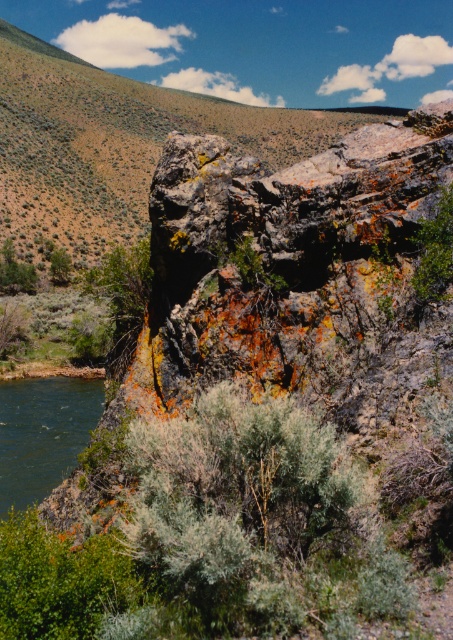
Question: Estimate the real-world distances between objects in this image. Which object is farther from the green leafy shrub at center?

Choices:
 (A) dark green water at lower left
 (B) green leafy shrub at left

Answer: (B)

Question: Which of these objects is positioned closest to the green leafy shrub at left?

Choices:
 (A) green leafy shrub at center
 (B) dark green water at lower left

Answer: (B)

Question: Does green leafy shrub at center have a larger size compared to green leafy shrub at left?

Choices:
 (A) no
 (B) yes

Answer: (A)

Question: Can you confirm if dark green water at lower left is positioned to the right of green leafy shrub at left?

Choices:
 (A) yes
 (B) no

Answer: (A)

Question: Estimate the real-world distances between objects in this image. Which object is farther from the green leafy shrub at left?

Choices:
 (A) dark green water at lower left
 (B) green leafy shrub at center

Answer: (B)

Question: Does dark green water at lower left have a lesser width compared to green leafy shrub at center?

Choices:
 (A) yes
 (B) no

Answer: (B)